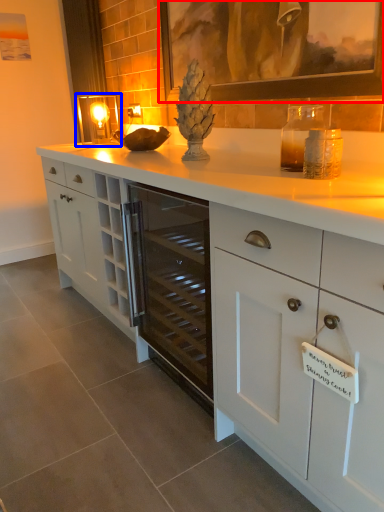
Question: Which of the following is the farthest to the observer, picture frame (highlighted by a red box) or candle holder (highlighted by a blue box)?

Choices:
 (A) picture frame
 (B) candle holder

Answer: (B)